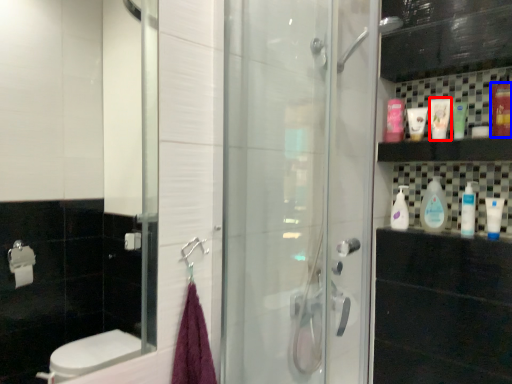
Question: Which object appears closest to the camera in this image, mouthwash (highlighted by a red box) or mouthwash (highlighted by a blue box)?

Choices:
 (A) mouthwash
 (B) mouthwash

Answer: (B)